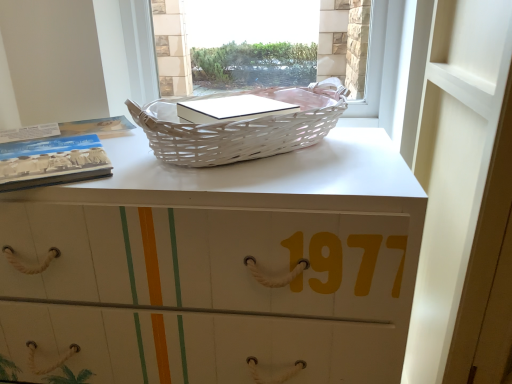
Question: Considering the positions of matte paper book at left and white wicker picnic basket at upper center in the image, is matte paper book at left bigger or smaller than white wicker picnic basket at upper center?

Choices:
 (A) small
 (B) big

Answer: (A)

Question: Is matte paper book at left spatially inside white wicker picnic basket at upper center, or outside of it?

Choices:
 (A) outside
 (B) inside

Answer: (A)

Question: Which of these objects is positioned farthest from the white matte desk at center?

Choices:
 (A) matte paper book at left
 (B) white wicker picnic basket at upper center
 (C) white wicker basket at upper center

Answer: (C)

Question: Estimate the real-world distances between objects in this image. Which object is closer to the white wicker picnic basket at upper center?

Choices:
 (A) white matte desk at center
 (B) matte paper book at left
 (C) white wicker basket at upper center

Answer: (A)